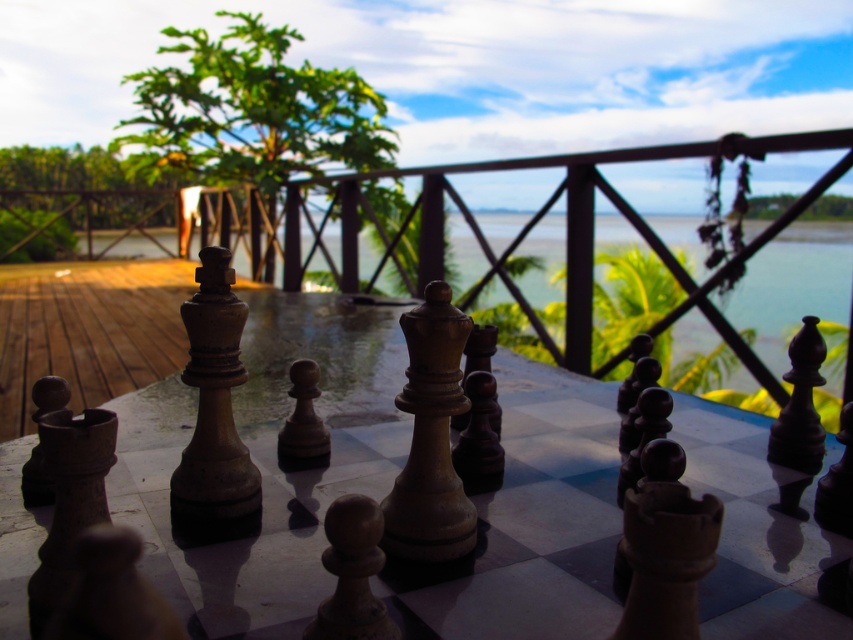
Question: Which object is farther from the camera taking this photo?

Choices:
 (A) transparent glass water at center
 (B) wooden chessboard at center

Answer: (A)

Question: Considering the relative positions of wooden chessboard at center and transparent glass water at center in the image provided, where is wooden chessboard at center located with respect to transparent glass water at center?

Choices:
 (A) below
 (B) above

Answer: (A)

Question: Can you confirm if wooden chessboard at center is bigger than transparent glass water at center?

Choices:
 (A) yes
 (B) no

Answer: (B)

Question: Which object appears farthest from the camera in this image?

Choices:
 (A) wooden chessboard at center
 (B) transparent glass water at center

Answer: (B)

Question: In this image, where is wooden chessboard at center located relative to transparent glass water at center?

Choices:
 (A) right
 (B) left

Answer: (B)